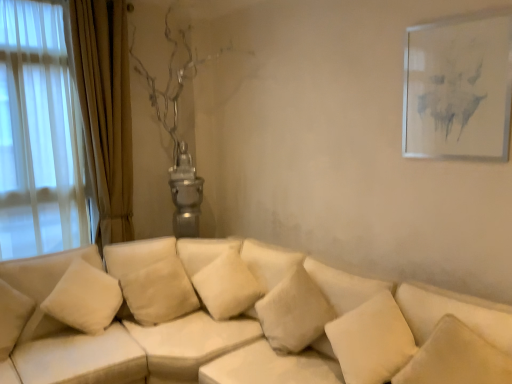
Question: In terms of size, does white soft pillow at lower right, which is the fifth pillow from left to right, appear bigger or smaller than white fabric couch at center?

Choices:
 (A) small
 (B) big

Answer: (A)

Question: Which is correct: white soft pillow at lower right, which is the fifth pillow from left to right, is inside white fabric couch at center, or outside of it?

Choices:
 (A) inside
 (B) outside

Answer: (A)

Question: Which of these objects is positioned closest to the white fabric couch at center?

Choices:
 (A) white soft pillow at center, which is the second pillow from left to right
 (B) white soft pillow at lower right, placed as the fourth pillow when sorted from left to right
 (C) soft beige cushion at center, which ranks as the third pillow in right-to-left order
 (D) white soft pillow at center, arranged as the 1th pillow when viewed from the left
 (E) white soft pillow at lower right, which is the fifth pillow from left to right

Answer: (D)

Question: Based on their relative distances, which object is nearer to the white matte picture frame at upper right?

Choices:
 (A) white soft pillow at lower right, which is the fifth pillow from left to right
 (B) white soft pillow at center, arranged as the 1th pillow when viewed from the left
 (C) white soft pillow at center, the 4th pillow from the right
 (D) white fabric couch at center
 (E) soft beige cushion at center, the 3th pillow viewed from the left

Answer: (A)